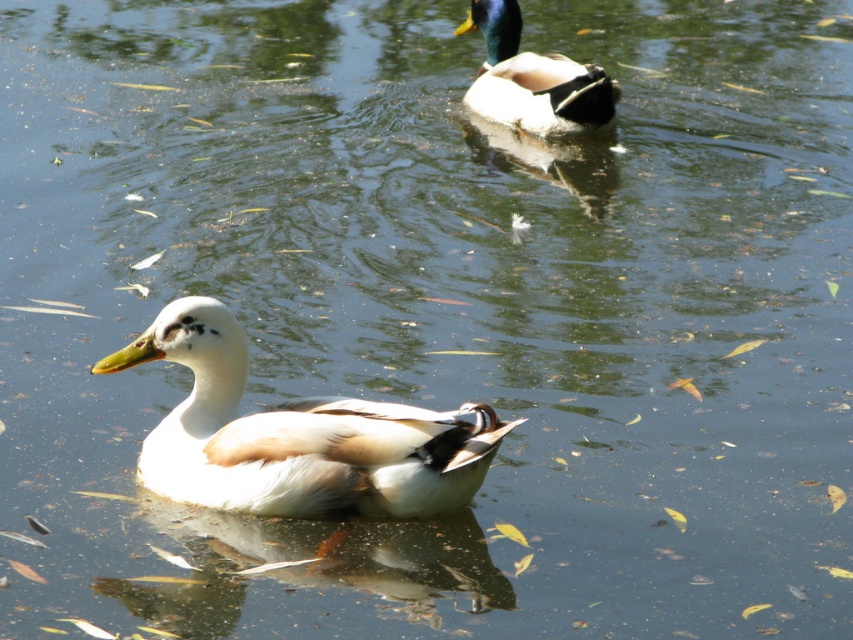
Question: Which of the following is the closest to the observer?

Choices:
 (A) white matte duck at center
 (B) shiny green and brown duck at upper center

Answer: (A)

Question: Does white matte duck at center appear on the left side of shiny green and brown duck at upper center?

Choices:
 (A) yes
 (B) no

Answer: (A)

Question: Can you confirm if white matte duck at center is positioned to the left of shiny green and brown duck at upper center?

Choices:
 (A) yes
 (B) no

Answer: (A)

Question: Which object is farther from the camera taking this photo?

Choices:
 (A) white matte duck at center
 (B) shiny green and brown duck at upper center

Answer: (B)

Question: Is the position of white matte duck at center more distant than that of shiny green and brown duck at upper center?

Choices:
 (A) yes
 (B) no

Answer: (B)

Question: Which of the following is the closest to the observer?

Choices:
 (A) coord(467,476)
 (B) coord(515,90)

Answer: (A)